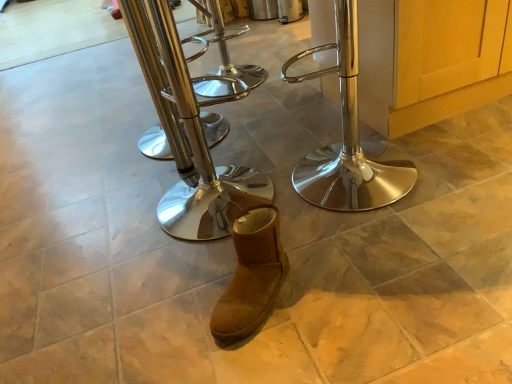
The width and height of the screenshot is (512, 384). Find the location of `polished chrome stool at center, which appears as the 1th step stool when viewed from the right`. polished chrome stool at center, which appears as the 1th step stool when viewed from the right is located at coordinates (347, 138).

Where is `brown suede boot at center`? This screenshot has width=512, height=384. brown suede boot at center is located at coordinates (251, 275).

In order to face brown suede boot at center, should I rotate leftwards or rightwards?

A 1.217 degree turn to the left will do.

At what (x,y) coordinates should I click in order to perform the action: click on polished chrome stool at center, which ranks as the 3th step stool in left-to-right order. Please return your answer as a coordinate pair (x, y). The image size is (512, 384). Looking at the image, I should click on pyautogui.click(x=347, y=138).

Image resolution: width=512 pixels, height=384 pixels. There is a polished metal bar stool at center, the third step stool viewed from the right. Identify the location of the 1st step stool below it (from the image's perspective). (347, 138).

Considering the sizes of objects polished metal bar stool at center, which is the 1th step stool from left to right, and polished chrome stool at center, which appears as the 1th step stool when viewed from the right, in the image provided, who is shorter, polished metal bar stool at center, which is the 1th step stool from left to right, or polished chrome stool at center, which appears as the 1th step stool when viewed from the right,?

polished chrome stool at center, which appears as the 1th step stool when viewed from the right.

From a real-world perspective, is polished metal bar stool at center, which is the 1th step stool from left to right, under polished chrome stool at center, which appears as the 1th step stool when viewed from the right?

No, from a real-world perspective, polished metal bar stool at center, which is the 1th step stool from left to right, is not below polished chrome stool at center, which appears as the 1th step stool when viewed from the right.

Visually, is polished chrome stool at center, the second step stool when ordered from left to right, positioned to the left or to the right of polished metal bar stool at center, the third step stool viewed from the right?

polished chrome stool at center, the second step stool when ordered from left to right, is positioned on polished metal bar stool at center, the third step stool viewed from the right,'s right side.

Considering the sizes of objects polished chrome stool at center, the second step stool when ordered from left to right, and polished metal bar stool at center, which is the 1th step stool from left to right, in the image provided, who is bigger, polished chrome stool at center, the second step stool when ordered from left to right, or polished metal bar stool at center, which is the 1th step stool from left to right,?

polished metal bar stool at center, which is the 1th step stool from left to right.

Can you confirm if polished chrome stool at center, the second step stool viewed from the right, is shorter than polished metal bar stool at center, which is the 1th step stool from left to right?

No.

Can you see polished chrome stool at center, the second step stool viewed from the right, touching polished metal bar stool at center, the third step stool viewed from the right?

Yes, the surface of polished chrome stool at center, the second step stool viewed from the right, is in contact with polished metal bar stool at center, the third step stool viewed from the right.

Visually, is polished chrome stool at center, which ranks as the 3th step stool in left-to-right order, positioned to the left or to the right of polished chrome stool at center, the second step stool when ordered from left to right?

From the image, it's evident that polished chrome stool at center, which ranks as the 3th step stool in left-to-right order, is to the right of polished chrome stool at center, the second step stool when ordered from left to right.

From the picture: From the image's perspective, which is above, polished chrome stool at center, which appears as the 1th step stool when viewed from the right, or polished chrome stool at center, the second step stool when ordered from left to right?

From the image's view, polished chrome stool at center, which appears as the 1th step stool when viewed from the right, is above.

In the scene shown: Does polished chrome stool at center, which appears as the 1th step stool when viewed from the right, have a lesser width compared to polished chrome stool at center, the second step stool viewed from the right?

No, polished chrome stool at center, which appears as the 1th step stool when viewed from the right, is not thinner than polished chrome stool at center, the second step stool viewed from the right.

From a real-world perspective, is polished chrome stool at center, the second step stool when ordered from left to right, positioned above or below polished chrome stool at center, which ranks as the 3th step stool in left-to-right order?

Clearly, from a real-world perspective, polished chrome stool at center, the second step stool when ordered from left to right, is above polished chrome stool at center, which ranks as the 3th step stool in left-to-right order.

Is the surface of polished chrome stool at center, the second step stool when ordered from left to right, in direct contact with polished chrome stool at center, which appears as the 1th step stool when viewed from the right?

No.

Does point (183, 225) appear closer or farther from the camera than point (415, 172)?

Point (183, 225) is closer to the camera than point (415, 172).

Looking at the image, does polished chrome stool at center, the second step stool viewed from the right, seem bigger or smaller compared to polished chrome stool at center, which ranks as the 3th step stool in left-to-right order?

In the image, polished chrome stool at center, the second step stool viewed from the right, appears to be larger than polished chrome stool at center, which ranks as the 3th step stool in left-to-right order.

Which of these two, brown suede boot at center or polished chrome stool at center, which appears as the 1th step stool when viewed from the right, stands shorter?

brown suede boot at center.

Can you confirm if brown suede boot at center is wider than polished chrome stool at center, which appears as the 1th step stool when viewed from the right?

In fact, brown suede boot at center might be narrower than polished chrome stool at center, which appears as the 1th step stool when viewed from the right.

Considering the positions of objects brown suede boot at center and polished chrome stool at center, which appears as the 1th step stool when viewed from the right, in the image provided, who is in front, brown suede boot at center or polished chrome stool at center, which appears as the 1th step stool when viewed from the right,?

brown suede boot at center is closer to the camera.

Based on their positions, is brown suede boot at center located to the left or right of polished chrome stool at center, which ranks as the 3th step stool in left-to-right order?

From the image, it's evident that brown suede boot at center is to the left of polished chrome stool at center, which ranks as the 3th step stool in left-to-right order.

From a real-world perspective, is brown suede boot at center above or below polished metal bar stool at center, the third step stool viewed from the right?

In terms of real-world spatial position, brown suede boot at center is below polished metal bar stool at center, the third step stool viewed from the right.

Is brown suede boot at center thinner than polished metal bar stool at center, which is the 1th step stool from left to right?

Correct, the width of brown suede boot at center is less than that of polished metal bar stool at center, which is the 1th step stool from left to right.

Is brown suede boot at center positioned far away from polished metal bar stool at center, the third step stool viewed from the right?

No, brown suede boot at center is in close proximity to polished metal bar stool at center, the third step stool viewed from the right.

Is brown suede boot at center facing away from polished metal bar stool at center, the third step stool viewed from the right?

No, brown suede boot at center is not facing away from polished metal bar stool at center, the third step stool viewed from the right.

Considering the relative sizes of brown suede boot at center and polished chrome stool at center, the second step stool viewed from the right, in the image provided, is brown suede boot at center wider than polished chrome stool at center, the second step stool viewed from the right,?

In fact, brown suede boot at center might be narrower than polished chrome stool at center, the second step stool viewed from the right.

From a real-world perspective, which step stool is the 3rd one above the brown suede boot at center? Please provide its 2D coordinates.

[(188, 134)]

Which is closer to the camera, (236, 288) or (204, 222)?

Point (236, 288).

Is brown suede boot at center positioned behind polished chrome stool at center, the second step stool viewed from the right?

Yes, brown suede boot at center is further from the camera.

This screenshot has width=512, height=384. There is a polished chrome stool at center, which appears as the 1th step stool when viewed from the right. In order to click on the 1st step stool above it (from a real-world perspective) in this screenshot , I will do `click(152, 83)`.

At what (x,y) coordinates should I click in order to perform the action: click on the 2nd step stool behind when counting from the polished chrome stool at center, the second step stool when ordered from left to right. Please return your answer as a coordinate pair (x, y). This screenshot has height=384, width=512. Looking at the image, I should click on (152, 83).

Estimate the real-world distances between objects in this image. Which object is further from polished chrome stool at center, which appears as the 1th step stool when viewed from the right, polished chrome stool at center, the second step stool when ordered from left to right, or brown suede boot at center?

brown suede boot at center.

Considering their positions, is brown suede boot at center positioned further to polished chrome stool at center, which ranks as the 3th step stool in left-to-right order, than polished chrome stool at center, the second step stool when ordered from left to right?

brown suede boot at center.

Which object lies further to the anchor point polished chrome stool at center, the second step stool viewed from the right, polished metal bar stool at center, which is the 1th step stool from left to right, or brown suede boot at center?

brown suede boot at center is positioned further to the anchor polished chrome stool at center, the second step stool viewed from the right.

Based on their spatial positions, is polished metal bar stool at center, which is the 1th step stool from left to right, or polished chrome stool at center, the second step stool when ordered from left to right, further from brown suede boot at center?

Based on the image, polished metal bar stool at center, which is the 1th step stool from left to right, appears to be further to brown suede boot at center.

Which object lies nearer to the anchor point polished metal bar stool at center, the third step stool viewed from the right, brown suede boot at center or polished chrome stool at center, which appears as the 1th step stool when viewed from the right?

The object closer to polished metal bar stool at center, the third step stool viewed from the right, is polished chrome stool at center, which appears as the 1th step stool when viewed from the right.

Looking at the image, which one is located further to polished chrome stool at center, which appears as the 1th step stool when viewed from the right, polished metal bar stool at center, which is the 1th step stool from left to right, or polished chrome stool at center, the second step stool when ordered from left to right?

Based on the image, polished metal bar stool at center, which is the 1th step stool from left to right, appears to be further to polished chrome stool at center, which appears as the 1th step stool when viewed from the right.

Estimate the real-world distances between objects in this image. Which object is further from polished chrome stool at center, which appears as the 1th step stool when viewed from the right, polished chrome stool at center, the second step stool when ordered from left to right, or polished metal bar stool at center, which is the 1th step stool from left to right?

Based on the image, polished metal bar stool at center, which is the 1th step stool from left to right, appears to be further to polished chrome stool at center, which appears as the 1th step stool when viewed from the right.

Estimate the real-world distances between objects in this image. Which object is closer to polished chrome stool at center, the second step stool viewed from the right, polished metal bar stool at center, which is the 1th step stool from left to right, or polished chrome stool at center, which ranks as the 3th step stool in left-to-right order?

polished metal bar stool at center, which is the 1th step stool from left to right, is positioned closer to the anchor polished chrome stool at center, the second step stool viewed from the right.

Find the location of a particular element. This screenshot has width=512, height=384. step stool between polished chrome stool at center, which appears as the 1th step stool when viewed from the right, and brown suede boot at center, in the vertical direction is located at coordinates (188, 134).

You are a GUI agent. You are given a task and a screenshot of the screen. Output one action in this format:
    pyautogui.click(x=<x>, y=<y>)
    Task: Click on the step stool between polished metal bar stool at center, which is the 1th step stool from left to right, and polished chrome stool at center, which ranks as the 3th step stool in left-to-right order
    The image size is (512, 384).
    Given the screenshot: What is the action you would take?
    pyautogui.click(x=188, y=134)